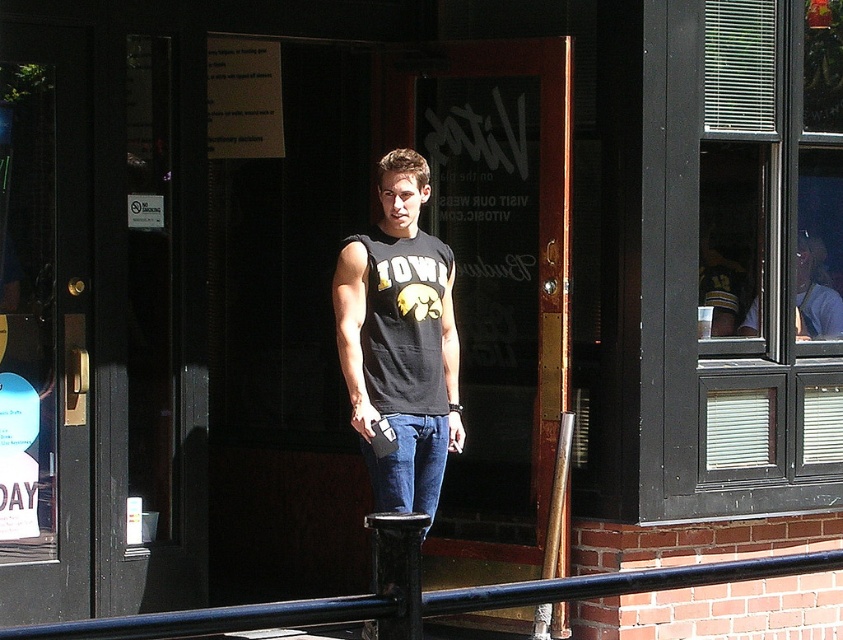
Question: Is black matte tank top at center thinner than black metal rail at center?

Choices:
 (A) yes
 (B) no

Answer: (A)

Question: Which point is farther to the camera?

Choices:
 (A) (415, 460)
 (B) (242, 605)

Answer: (A)

Question: Does black matte tank top at center come behind black metal rail at center?

Choices:
 (A) yes
 (B) no

Answer: (A)

Question: Which point is farther to the camera?

Choices:
 (A) jeans at center
 (B) black matte tank top at center

Answer: (A)

Question: Is black matte tank top at center above jeans at center?

Choices:
 (A) yes
 (B) no

Answer: (A)

Question: Among these objects, which one is nearest to the camera?

Choices:
 (A) black metal rail at center
 (B) black matte tank top at center

Answer: (A)